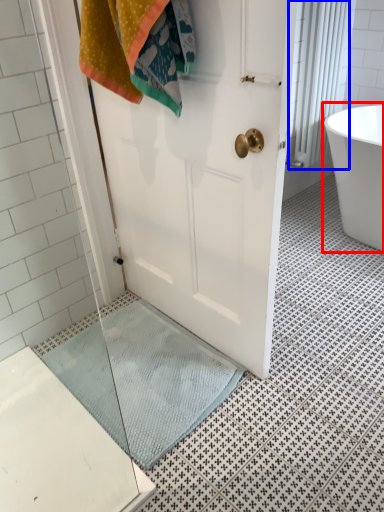
Question: Among these objects, which one is farthest to the camera, bathtub (highlighted by a red box) or shower curtain (highlighted by a blue box)?

Choices:
 (A) bathtub
 (B) shower curtain

Answer: (B)